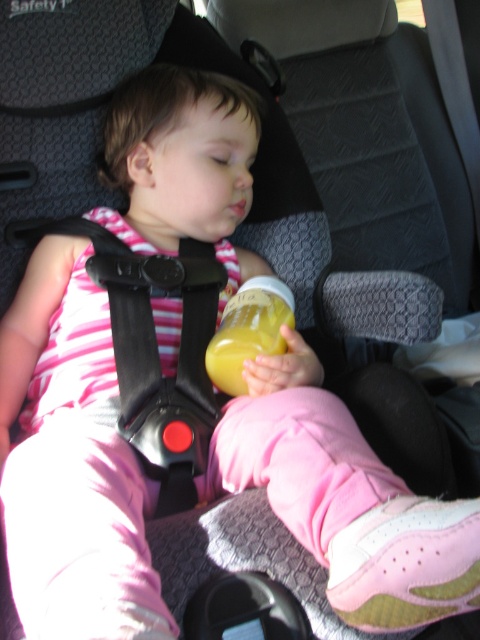
You are a parent trying to ensure your child is safe in the car. You notice the black plastic strap at center and the yellow matte bottle at center. Which object is closer to the other?

The black plastic strap at center is 13.66 centimeters away from the yellow matte bottle at center, so they are not very close to each other.

You are a parent trying to adjust the black plastic strap at center of your child seat. If your hand is 36.40 inches away from the strap, can you reach it without moving your position?

The black plastic strap at center and viewer are 36.40 inches apart. Since your hand is at the same distance as the viewer, you can reach the strap as it is within arm reach.

Consider the image. You are a parent checking the car seat of your child. You notice the black plastic strap at center and the yellow matte bottle at center. Which object is positioned to the right side of the other?

The black plastic strap at center is to the left of the yellow matte bottle at center, so the yellow matte bottle at center is positioned to the right side of the black plastic strap at center.